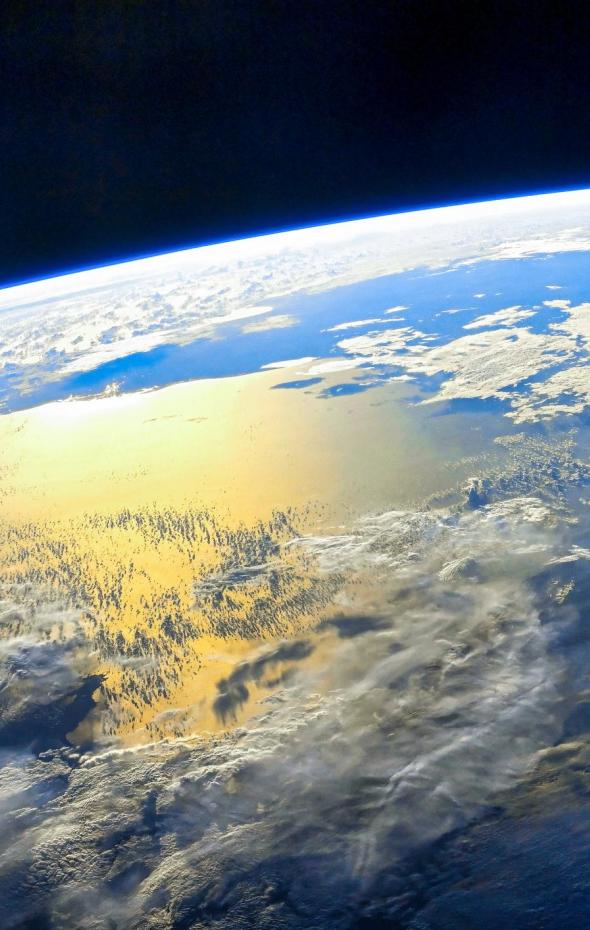
Find the location of a particular element. This screenshot has width=590, height=930. yellow light is located at coordinates [x=76, y=432].